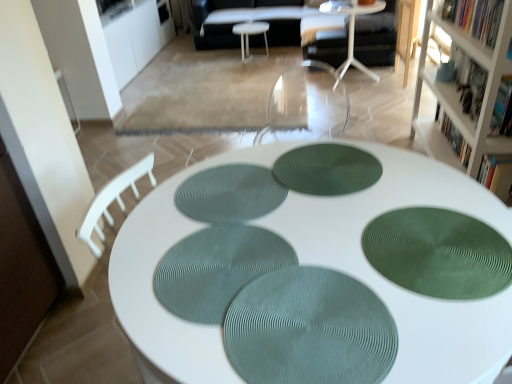
Locate an element on the screen. The width and height of the screenshot is (512, 384). vacant space in teal textured placemat at center, the third mat viewed from the right (from a real-world perspective) is located at coordinates (230, 285).